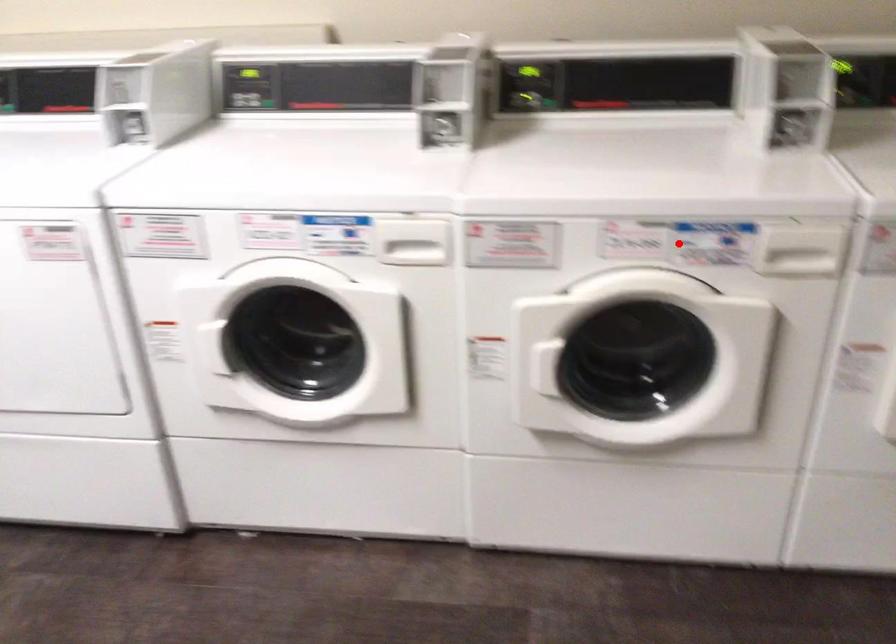
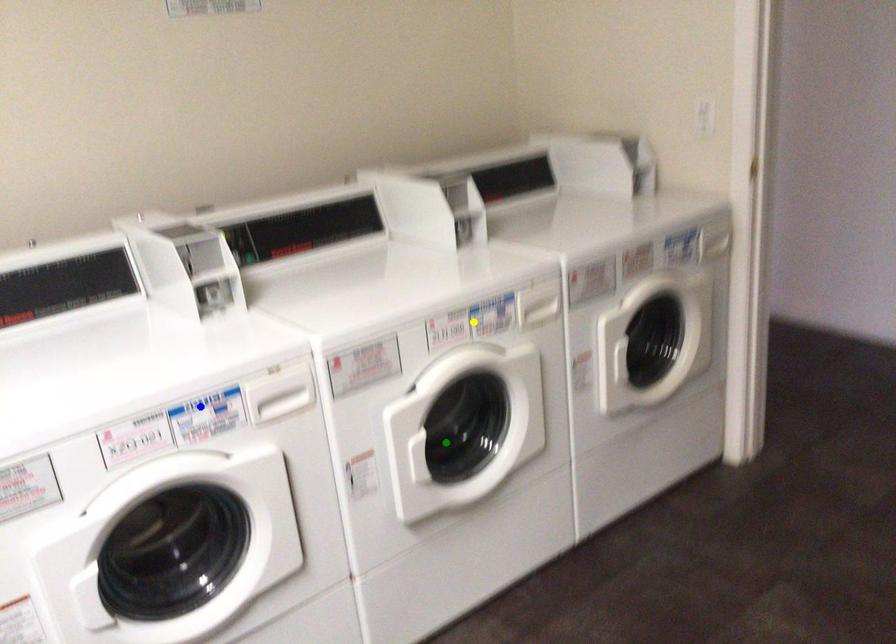
Question: I am providing you with two images of the same scene from different viewpoints. A red point is marked on the first image. You are given multiple points on the second image. Which mark in image 2 goes with the point in image 1?

Choices:
 (A) green point
 (B) blue point
 (C) yellow point

Answer: (C)